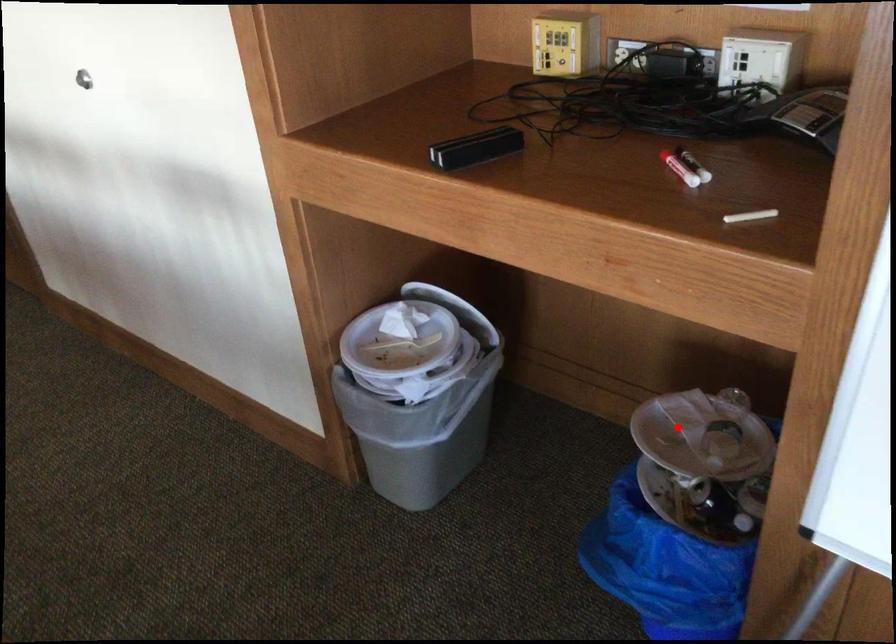
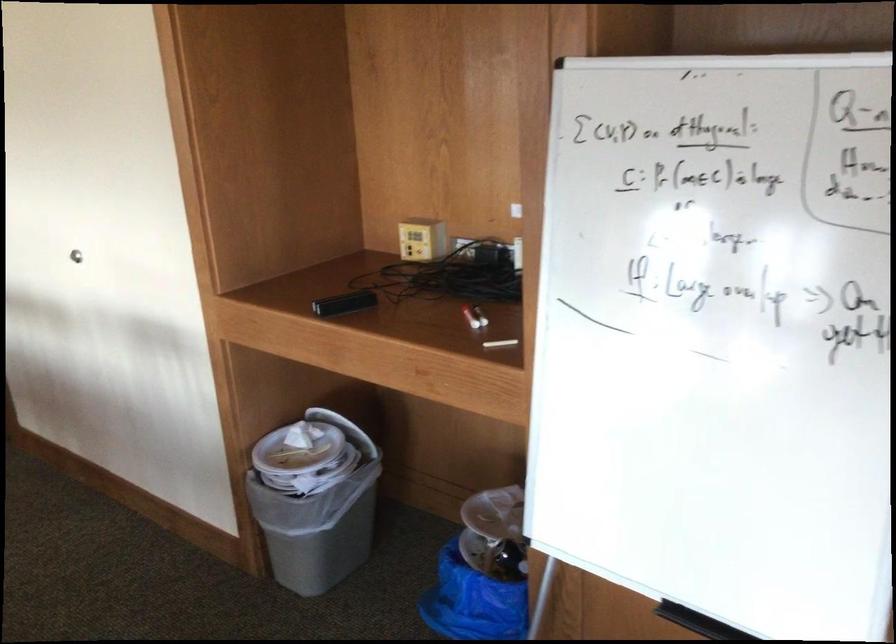
Question: I am providing you with two images of the same scene from different viewpoints. Image1 has a red point marked. In image2, the corresponding 3D location appears at what relative position? Reply with the corresponding letter.

Choices:
 (A) Closer
 (B) Farther

Answer: (B)